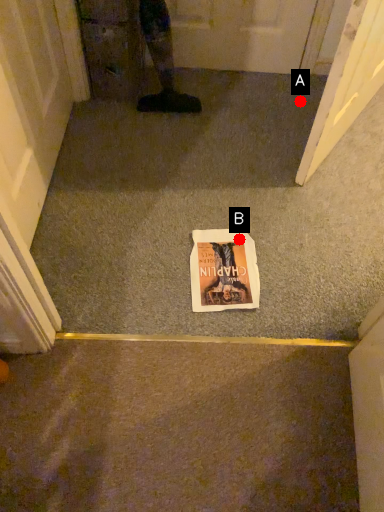
Question: Two points are circled on the image, labeled by A and B beside each circle. Which point appears closest to the camera in this image?

Choices:
 (A) A is closer
 (B) B is closer

Answer: (B)